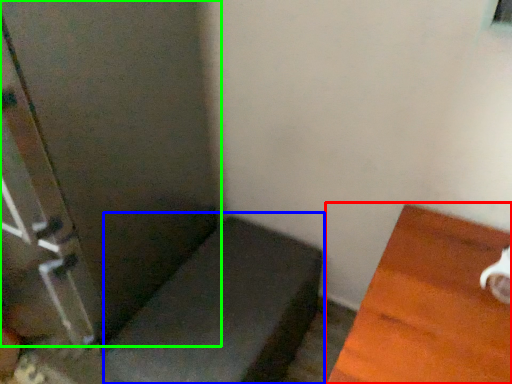
Question: Which object is positioned farthest from furniture (highlighted by a red box)? Select from furniture (highlighted by a blue box) and screen door (highlighted by a green box).

Choices:
 (A) furniture
 (B) screen door

Answer: (B)